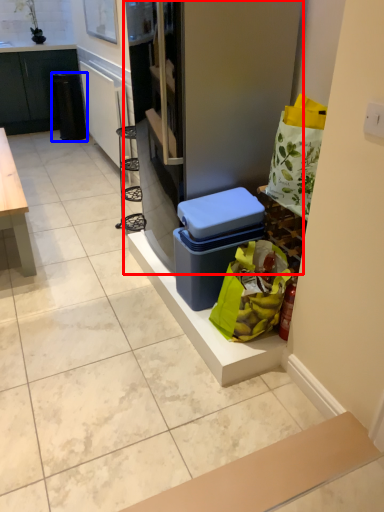
Question: Among these objects, which one is nearest to the camera, fridge (highlighted by a red box) or trash bin/can (highlighted by a blue box)?

Choices:
 (A) fridge
 (B) trash bin/can

Answer: (A)